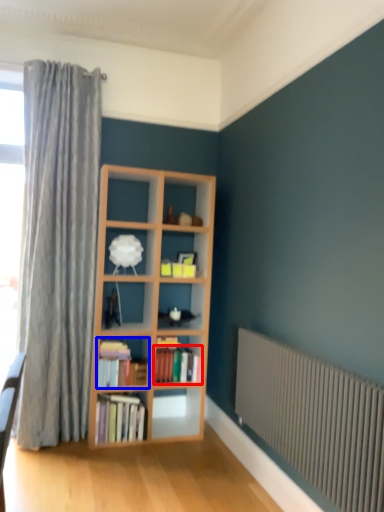
Question: Which object appears farthest to the camera in this image, book (highlighted by a red box) or book (highlighted by a blue box)?

Choices:
 (A) book
 (B) book

Answer: (A)